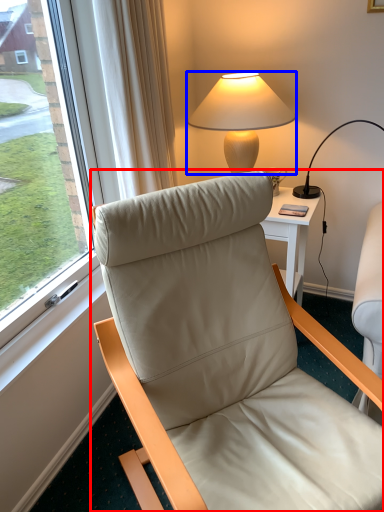
Question: Which object appears closest to the camera in this image, chair (highlighted by a red box) or lamp (highlighted by a blue box)?

Choices:
 (A) chair
 (B) lamp

Answer: (A)